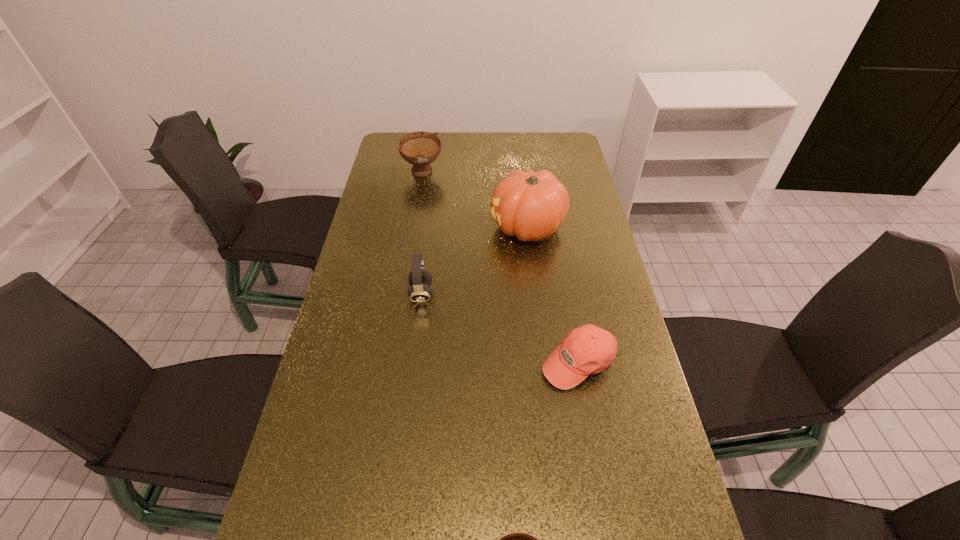
I want to click on object that can be found as the third closest to the farthest object, so click(588, 349).

Locate an element on the screen. soup bowl that stands as the second closest to the pumpkin is located at coordinates (516, 539).

Locate an element on the screen. vacant space that satisfies the following two spatial constraints: 1. on the carved face of the second shortest object; 2. on the right side of the tallest object is located at coordinates (543, 362).

The width and height of the screenshot is (960, 540). Find the location of `blank space that satisfies the following two spatial constraints: 1. on the carved face of the baseball cap; 2. on the right side of the pumpkin`. blank space that satisfies the following two spatial constraints: 1. on the carved face of the baseball cap; 2. on the right side of the pumpkin is located at coordinates (543, 362).

Where is `vacant point that satisfies the following two spatial constraints: 1. on the back side of the second shortest object; 2. on the ear cups of the headset`? vacant point that satisfies the following two spatial constraints: 1. on the back side of the second shortest object; 2. on the ear cups of the headset is located at coordinates (565, 294).